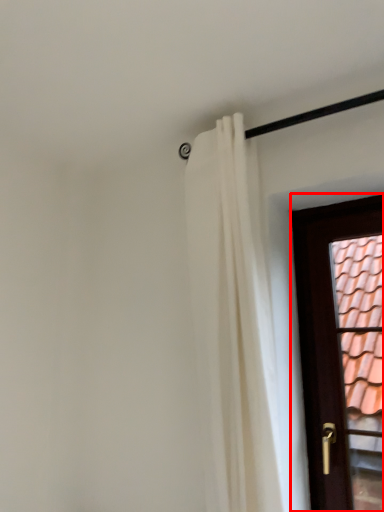
Question: Considering the relative positions of door (annotated by the red box) and curtain in the image provided, where is door (annotated by the red box) located with respect to the staircase?

Choices:
 (A) right
 (B) left

Answer: (A)